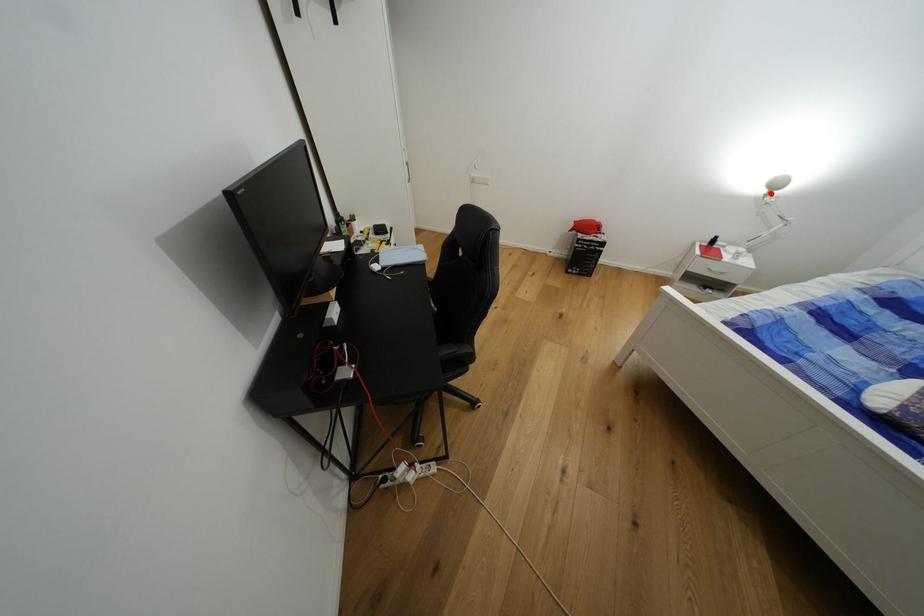
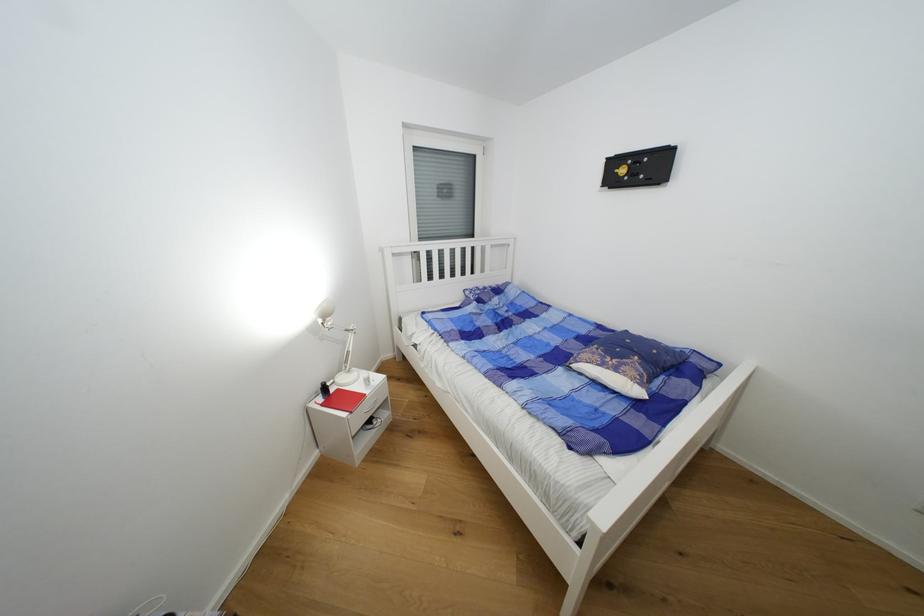
Question: I am providing you with two images of the same scene from different viewpoints. In image1, a red point is highlighted. Considering the same 3D point in image2, which of the following is correct?

Choices:
 (A) It is closer
 (B) It is farther

Answer: (A)